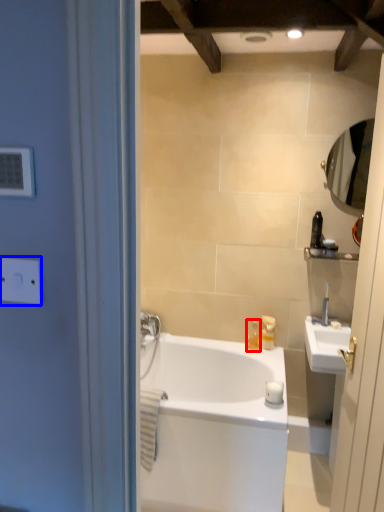
Question: Which object appears farthest to the camera in this image, toiletry (highlighted by a red box) or electric outlet (highlighted by a blue box)?

Choices:
 (A) toiletry
 (B) electric outlet

Answer: (A)